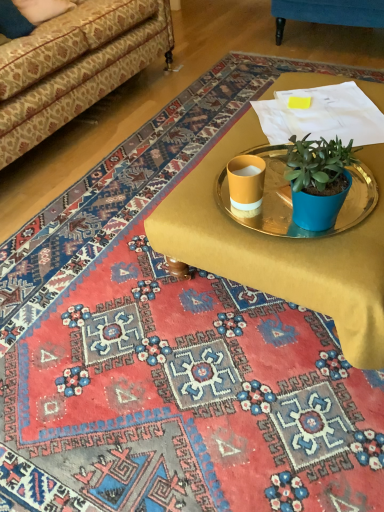
Question: From the image's perspective, is metallic gold tray at center above or below matte yellow cup at center?

Choices:
 (A) above
 (B) below

Answer: (A)

Question: Considering their positions, is metallic gold tray at center located in front of or behind matte yellow cup at center?

Choices:
 (A) front
 (B) behind

Answer: (A)

Question: Which of these objects is positioned farthest from the patterned fabric couch at upper left?

Choices:
 (A) metallic gold tray at center
 (B) gold metallic tray at center
 (C) matte yellow cup at center

Answer: (C)

Question: Which of these objects is positioned farthest from the metallic gold tray at center?

Choices:
 (A) patterned fabric couch at upper left
 (B) gold metallic tray at center
 (C) matte yellow cup at center

Answer: (A)